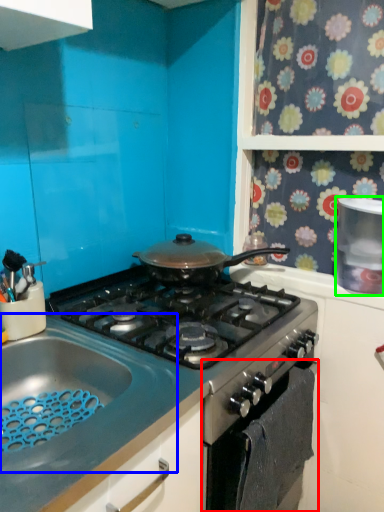
Question: Which object is the closest to the oven (highlighted by a red box)? Choose among these: sink (highlighted by a blue box) or kitchen appliance (highlighted by a green box).

Choices:
 (A) sink
 (B) kitchen appliance

Answer: (A)